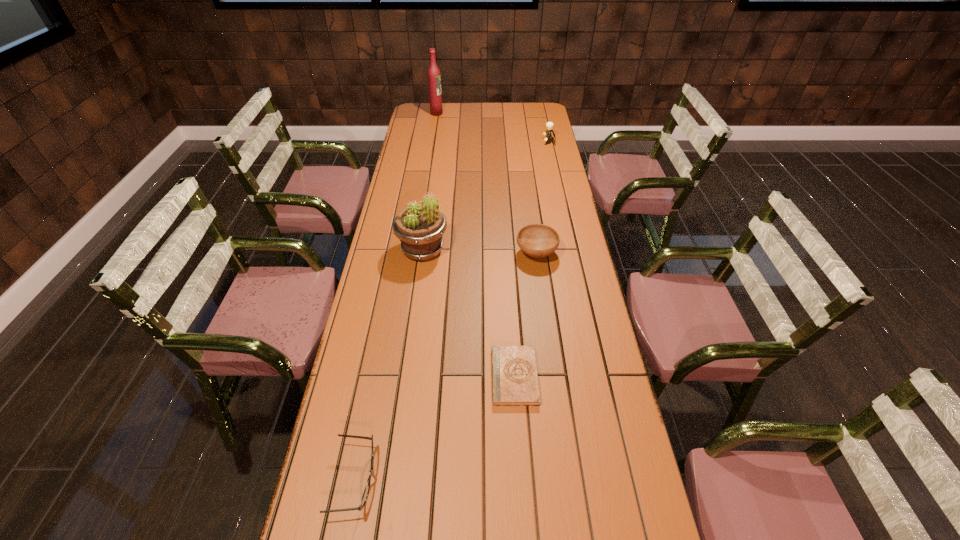
The width and height of the screenshot is (960, 540). Identify the location of object that ranks as the fifth closest to the liquor. (366, 491).

Where is `object that ranks as the fifth closest to the fourth tallest object`? The width and height of the screenshot is (960, 540). object that ranks as the fifth closest to the fourth tallest object is located at coordinates (434, 79).

You are a GUI agent. You are given a task and a screenshot of the screen. Output one action in this format:
    pyautogui.click(x=<x>, y=<y>)
    Task: Click on the vacant area in the image that satisfies the following two spatial constraints: 1. on the label of the flowerpot; 2. on the left side of the farthest object
    
    Given the screenshot: What is the action you would take?
    pyautogui.click(x=416, y=250)

You are a GUI agent. You are given a task and a screenshot of the screen. Output one action in this format:
    pyautogui.click(x=<x>, y=<y>)
    Task: Click on the vacant area that satisfies the following two spatial constraints: 1. on the back side of the flowerpot; 2. on the label of the farthest object
    The width and height of the screenshot is (960, 540).
    Given the screenshot: What is the action you would take?
    pyautogui.click(x=442, y=113)

The image size is (960, 540). Find the location of `vacant space that satisfies the following two spatial constraints: 1. on the label of the liquor; 2. on the back side of the flowerpot`. vacant space that satisfies the following two spatial constraints: 1. on the label of the liquor; 2. on the back side of the flowerpot is located at coordinates (416, 250).

Find the location of a particular element. This screenshot has width=960, height=540. free space that satisfies the following two spatial constraints: 1. on the label of the tallest object; 2. on the right side of the third shortest object is located at coordinates (415, 254).

The width and height of the screenshot is (960, 540). Find the location of `free space that satisfies the following two spatial constraints: 1. on the front side of the flowerpot; 2. on the front-facing side of the spectacles`. free space that satisfies the following two spatial constraints: 1. on the front side of the flowerpot; 2. on the front-facing side of the spectacles is located at coordinates (392, 480).

You are a GUI agent. You are given a task and a screenshot of the screen. Output one action in this format:
    pyautogui.click(x=<x>, y=<y>)
    Task: Click on the vacant space that satisfies the following two spatial constraints: 1. on the label of the second tallest object; 2. on the right side of the farthest object
    This screenshot has width=960, height=540.
    Given the screenshot: What is the action you would take?
    pyautogui.click(x=416, y=250)

Where is `vacant point that satisfies the following two spatial constraints: 1. on the label of the farthest object; 2. on the left side of the third shortest object`? Image resolution: width=960 pixels, height=540 pixels. vacant point that satisfies the following two spatial constraints: 1. on the label of the farthest object; 2. on the left side of the third shortest object is located at coordinates (415, 254).